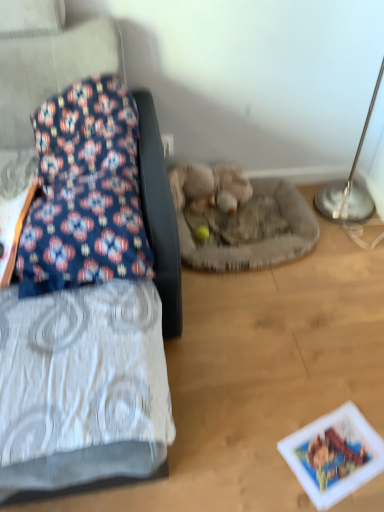
Question: From the image's perspective, relative to fuzzy beige stuffed animal at center, is floral fabric pillow at left above or below?

Choices:
 (A) below
 (B) above

Answer: (A)

Question: Is floral fabric pillow at left in front of or behind fuzzy beige stuffed animal at center in the image?

Choices:
 (A) front
 (B) behind

Answer: (A)

Question: Which object is positioned farthest from the floral fabric pillow at left?

Choices:
 (A) printed paper postcard at lower right
 (B) floral fabric cushion at left
 (C) silver metallic table lamp at upper right
 (D) fuzzy beige stuffed animal at center

Answer: (C)

Question: Which of these objects is positioned farthest from the silver metallic table lamp at upper right?

Choices:
 (A) floral fabric cushion at left
 (B) printed paper postcard at lower right
 (C) fuzzy beige stuffed animal at center
 (D) floral fabric pillow at left

Answer: (D)